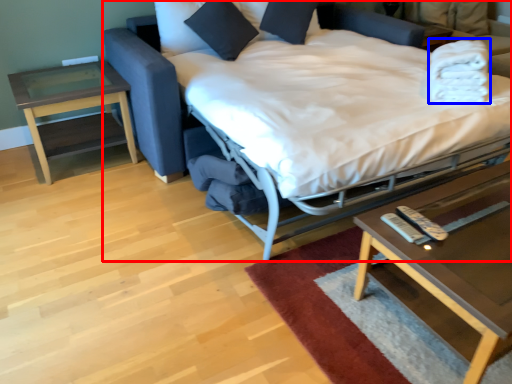
Question: Which object appears farthest to the camera in this image, bed (highlighted by a red box) or blanket (highlighted by a blue box)?

Choices:
 (A) bed
 (B) blanket

Answer: (B)